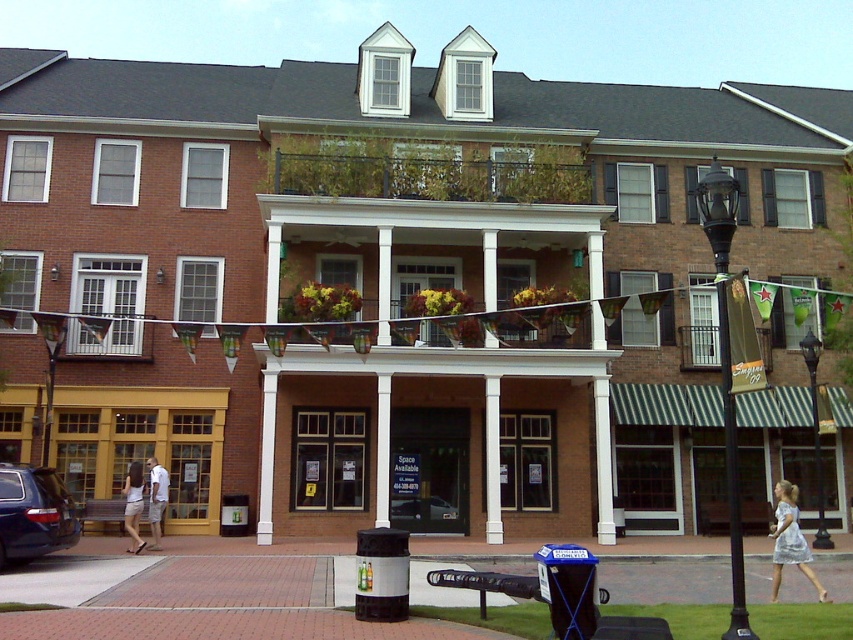
Question: Among these objects, which one is nearest to the camera?

Choices:
 (A) white cotton dress at center
 (B) black polished metal streetlamp at center right
 (C) matte black suv at lower left
 (D) metallic silver car at center

Answer: (B)

Question: Is black polished metal streetlamp at center right closer to camera compared to metallic silver car at center?

Choices:
 (A) yes
 (B) no

Answer: (A)

Question: Estimate the real-world distances between objects in this image. Which object is closer to the black metal lamp post at center?

Choices:
 (A) black polished metal streetlamp at center right
 (B) matte black suv at lower left
 (C) silver glitter dress at lower right
 (D) metallic silver car at center

Answer: (C)

Question: Which of these objects is positioned closest to the matte black suv at lower left?

Choices:
 (A) silver glitter dress at lower right
 (B) black metal lamp post at center
 (C) white cotton dress at center
 (D) metallic silver car at center

Answer: (C)

Question: Does black polished metal streetlamp at center right lie in front of white cotton dress at center?

Choices:
 (A) no
 (B) yes

Answer: (B)

Question: Is matte black suv at lower left closer to camera compared to metallic silver car at center?

Choices:
 (A) no
 (B) yes

Answer: (B)